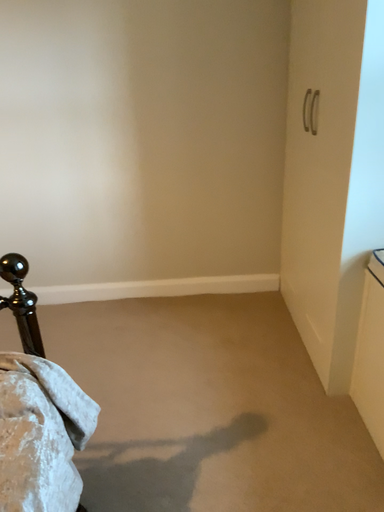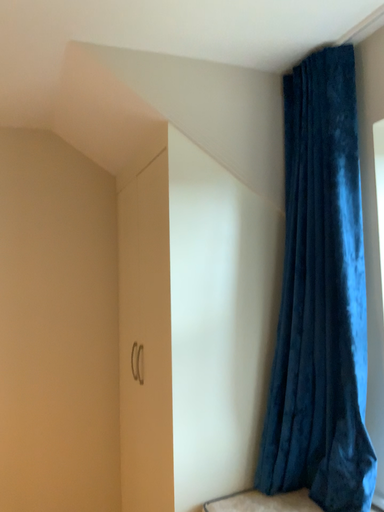
Question: Which way did the camera rotate in the video?

Choices:
 (A) rotated downward
 (B) rotated upward

Answer: (B)